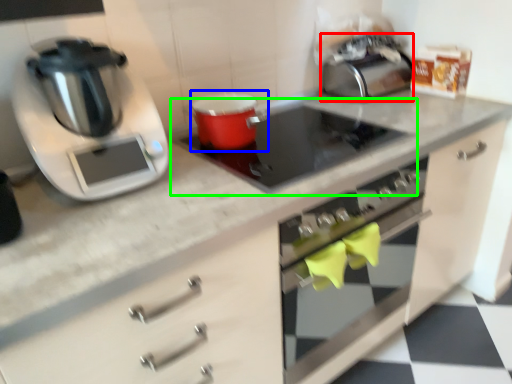
Question: Considering the real-world distances, which object is farthest from toaster (highlighted by a red box)? appliance (highlighted by a blue box) or gas stove (highlighted by a green box)?

Choices:
 (A) appliance
 (B) gas stove

Answer: (A)